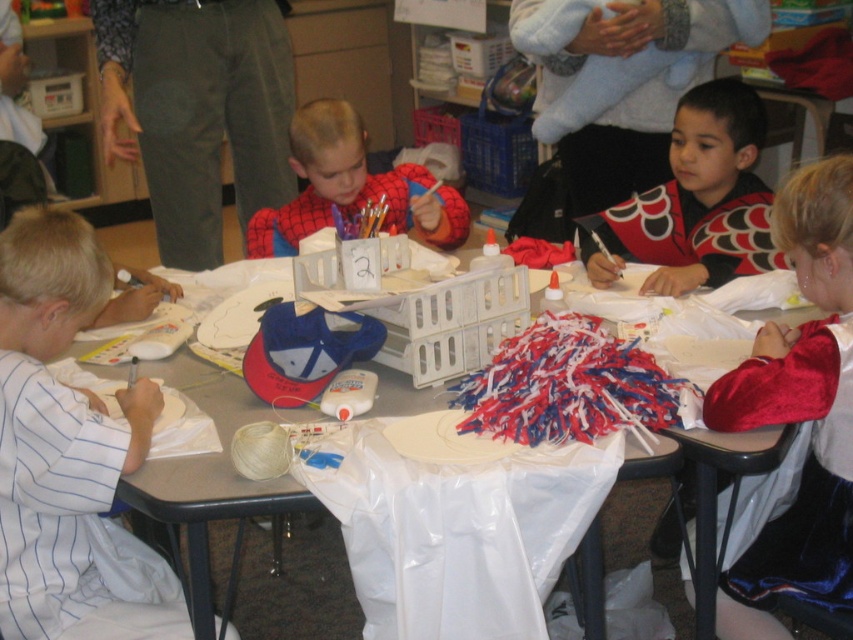
You are a teacher in the classroom and want to distribute craft supplies to the children wearing the white striped shirt at left and the red and black costume at center. Since the supplies are on the table, which child should you ask to reach for the items first?

The white striped shirt at left should reach for the items first because they are closer to the table compared to the red and black costume at center.

Where is the red and black costume at center located in the image?

The red and black costume at center is located at point (695,200) in the image.